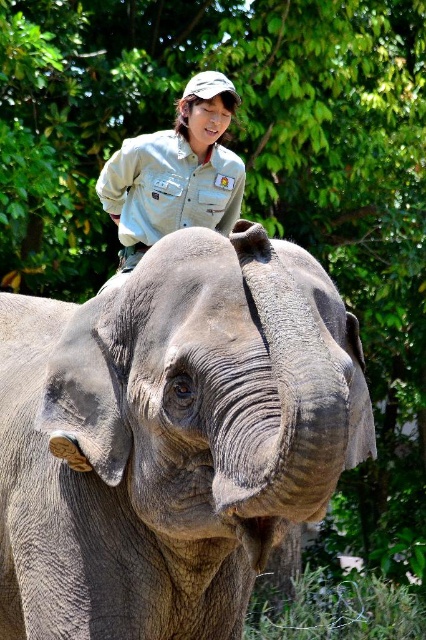
Is gray textured elephant at center to the right of light brown uniform at upper center from the viewer's perspective?

Indeed, gray textured elephant at center is positioned on the right side of light brown uniform at upper center.

Can you confirm if gray textured elephant at center is thinner than light brown uniform at upper center?

In fact, gray textured elephant at center might be wider than light brown uniform at upper center.

You are a GUI agent. You are given a task and a screenshot of the screen. Output one action in this format:
    pyautogui.click(x=<x>, y=<y>)
    Task: Click on the gray textured elephant at center
    
    Given the screenshot: What is the action you would take?
    pyautogui.click(x=172, y=436)